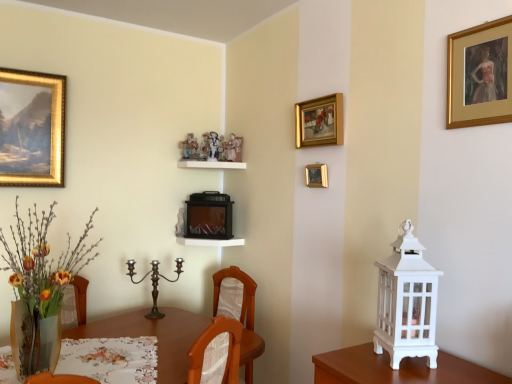
Question: Which direction should I rotate to look at polished bronze candle holder at center, marked as the second candle holder in a right-to-left arrangement, — up or down?

Choices:
 (A) up
 (B) down

Answer: (B)

Question: Considering the relative sizes of polished bronze candle holder at center, arranged as the 2th candle holder when viewed from the front, and gold/golden frame at upper right, which is the 1th picture frame from front to back, in the image provided, is polished bronze candle holder at center, arranged as the 2th candle holder when viewed from the front, taller than gold/golden frame at upper right, which is the 1th picture frame from front to back,?

Choices:
 (A) yes
 (B) no

Answer: (B)

Question: Does polished bronze candle holder at center, marked as the second candle holder in a right-to-left arrangement, have a lesser width compared to gold/golden frame at upper right, the 1th picture frame when ordered from right to left?

Choices:
 (A) yes
 (B) no

Answer: (B)

Question: Are polished bronze candle holder at center, marked as the second candle holder in a right-to-left arrangement, and gold/golden frame at upper right, the 1th picture frame when ordered from right to left, far apart?

Choices:
 (A) yes
 (B) no

Answer: (A)

Question: Is polished bronze candle holder at center, which appears as the 1th candle holder when viewed from the left, located outside gold/golden frame at upper right, marked as the third picture frame in a left-to-right arrangement?

Choices:
 (A) yes
 (B) no

Answer: (A)

Question: Is the position of polished bronze candle holder at center, marked as the second candle holder in a right-to-left arrangement, more distant than that of gold/golden frame at upper right, which is the 1th picture frame from front to back?

Choices:
 (A) no
 (B) yes

Answer: (B)

Question: From a real-world perspective, does polished bronze candle holder at center, marked as the second candle holder in a right-to-left arrangement, stand above gold/golden frame at upper right, marked as the third picture frame in a left-to-right arrangement?

Choices:
 (A) yes
 (B) no

Answer: (B)

Question: Is brown wooden table at center shorter than white painted wood lantern at right, which is counted as the first candle holder, starting from the right?

Choices:
 (A) yes
 (B) no

Answer: (A)

Question: Are brown wooden table at center and white painted wood lantern at right, which is counted as the second candle holder, starting from the left, beside each other?

Choices:
 (A) yes
 (B) no

Answer: (B)

Question: From the image's perspective, does brown wooden table at center appear higher than white painted wood lantern at right, which is the 1th candle holder from front to back?

Choices:
 (A) no
 (B) yes

Answer: (A)

Question: Is white painted wood lantern at right, the second candle holder from the back, at the back of brown wooden table at center?

Choices:
 (A) yes
 (B) no

Answer: (A)

Question: Considering the relative sizes of brown wooden table at center and white painted wood lantern at right, which is the 1th candle holder from front to back, in the image provided, is brown wooden table at center bigger than white painted wood lantern at right, which is the 1th candle holder from front to back,?

Choices:
 (A) no
 (B) yes

Answer: (B)

Question: Can white painted wood lantern at right, the second candle holder from the back, be found inside brown wooden table at center?

Choices:
 (A) no
 (B) yes

Answer: (A)

Question: Considering the relative positions of polished bronze candle holder at center, positioned as the 1th candle holder in back-to-front order, and floral lace tablecloth at lower left in the image provided, is polished bronze candle holder at center, positioned as the 1th candle holder in back-to-front order, to the left of floral lace tablecloth at lower left from the viewer's perspective?

Choices:
 (A) no
 (B) yes

Answer: (A)